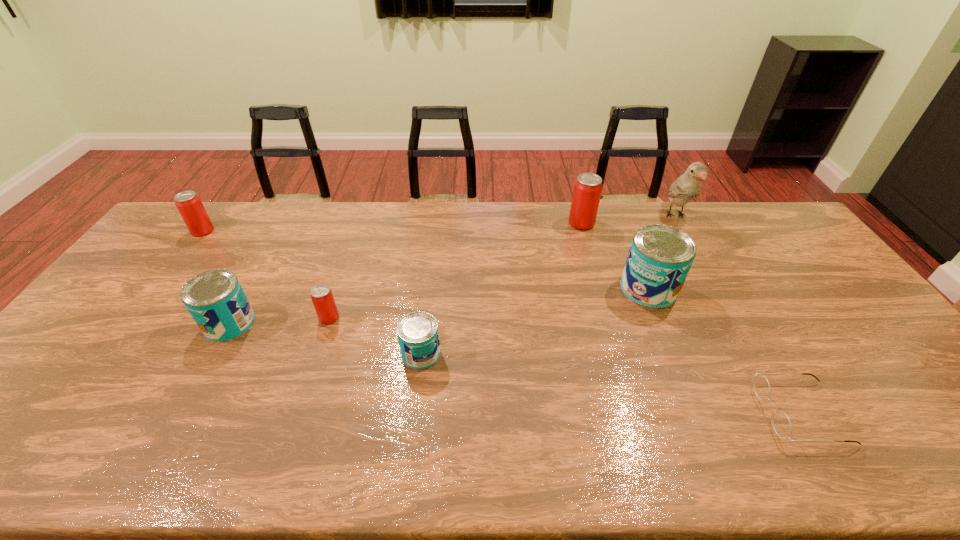
Locate an element on the screen. free space located on the back of the second biggest blue can is located at coordinates (253, 280).

The width and height of the screenshot is (960, 540). I want to click on vacant space located 0.190m on the back of the second blue can from right to left, so click(x=429, y=289).

What are the coordinates of `vacant space located on the right of the sixth object from right to left` in the screenshot? It's located at (420, 318).

In order to click on vacant region located on the front-facing side of the shortest object in this screenshot , I will do `click(716, 413)`.

The height and width of the screenshot is (540, 960). Identify the location of vacant space located 0.300m on the front-facing side of the shortest object. (636, 413).

You are a GUI agent. You are given a task and a screenshot of the screen. Output one action in this format:
    pyautogui.click(x=<x>, y=<y>)
    Task: Click on the vacant position located 0.270m on the front-facing side of the shortest object
    The image size is (960, 540).
    Given the screenshot: What is the action you would take?
    pyautogui.click(x=649, y=413)

The height and width of the screenshot is (540, 960). What are the coordinates of `bird that is positioned at the far edge` in the screenshot? It's located at (686, 187).

At what (x,y) coordinates should I click in order to perform the action: click on object at the near edge. Please return your answer as a coordinate pair (x, y). The width and height of the screenshot is (960, 540). Looking at the image, I should click on (781, 423).

Find the location of a particular element. The width and height of the screenshot is (960, 540). object at the left edge is located at coordinates (188, 203).

Identify the location of object present at the far left corner. (188, 203).